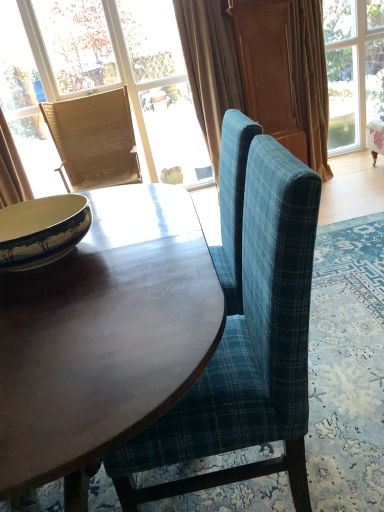
Image resolution: width=384 pixels, height=512 pixels. What do you see at coordinates (94, 140) in the screenshot? I see `woven wicker chair at left, which appears as the 2th chair when viewed from the right` at bounding box center [94, 140].

The width and height of the screenshot is (384, 512). What do you see at coordinates (11, 170) in the screenshot?
I see `beige fabric curtain at left, which appears as the 3th curtain when viewed from the right` at bounding box center [11, 170].

I want to click on silky beige curtain at upper right, positioned as the 1th curtain in right-to-left order, so click(x=309, y=80).

What do you see at coordinates (247, 349) in the screenshot? Image resolution: width=384 pixels, height=512 pixels. I see `blue plaid fabric chair at center, positioned as the first chair in right-to-left order` at bounding box center [247, 349].

The width and height of the screenshot is (384, 512). Describe the element at coordinates (353, 69) in the screenshot. I see `clear glass window at upper right, which ranks as the 1th window in right-to-left order` at that location.

The height and width of the screenshot is (512, 384). What do you see at coordinates (42, 230) in the screenshot?
I see `yellow glazed bowl at left` at bounding box center [42, 230].

Find the location of a particular element. wooden screen door at upper center is located at coordinates (266, 69).

Can you confirm if matte wicker chair at upper left, positioned as the first window in left-to-right order, is bigger than clear glass window at upper right, which ranks as the 1th window in right-to-left order?

Incorrect, matte wicker chair at upper left, positioned as the first window in left-to-right order, is not larger than clear glass window at upper right, which ranks as the 1th window in right-to-left order.

Considering the relative positions of matte wicker chair at upper left, arranged as the 2th window when viewed from the right, and clear glass window at upper right, which is the second window in left-to-right order, in the image provided, is matte wicker chair at upper left, arranged as the 2th window when viewed from the right, in front of clear glass window at upper right, which is the second window in left-to-right order,?

Yes, matte wicker chair at upper left, arranged as the 2th window when viewed from the right, is in front of clear glass window at upper right, which is the second window in left-to-right order.

Does matte wicker chair at upper left, arranged as the 2th window when viewed from the right, have a greater height compared to clear glass window at upper right, which ranks as the 1th window in right-to-left order?

Indeed, matte wicker chair at upper left, arranged as the 2th window when viewed from the right, has a greater height compared to clear glass window at upper right, which ranks as the 1th window in right-to-left order.

Is matte wicker chair at upper left, arranged as the 2th window when viewed from the right, not inside clear glass window at upper right, which is the second window in left-to-right order?

matte wicker chair at upper left, arranged as the 2th window when viewed from the right, is positioned outside clear glass window at upper right, which is the second window in left-to-right order.

Is matte dark wood desk at center further to the viewer compared to beige fabric curtain at left, which appears as the 3th curtain when viewed from the right?

No.

Are matte dark wood desk at center and beige fabric curtain at left, which appears as the 3th curtain when viewed from the right, far apart?

That's right, there is a large distance between matte dark wood desk at center and beige fabric curtain at left, which appears as the 3th curtain when viewed from the right.

Which is in front, point (28, 317) or point (19, 161)?

Point (28, 317)

Which is more to the left, matte dark wood desk at center or beige fabric curtain at left, which is the first curtain from left to right?

From the viewer's perspective, beige fabric curtain at left, which is the first curtain from left to right, appears more on the left side.

Does silky beige curtain at upper right, positioned as the 1th curtain in right-to-left order, have a larger size compared to yellow glazed bowl at left?

Yes, silky beige curtain at upper right, positioned as the 1th curtain in right-to-left order, is bigger than yellow glazed bowl at left.

Does silky beige curtain at upper right, positioned as the 1th curtain in right-to-left order, have a greater width compared to yellow glazed bowl at left?

Yes, silky beige curtain at upper right, positioned as the 1th curtain in right-to-left order, is wider than yellow glazed bowl at left.

From a real-world perspective, relative to yellow glazed bowl at left, is silky beige curtain at upper right, arranged as the 3th curtain when viewed from the left, vertically above or below?

From a real-world perspective, silky beige curtain at upper right, arranged as the 3th curtain when viewed from the left, is physically below yellow glazed bowl at left.

Is the surface of silky beige curtain at upper right, arranged as the 3th curtain when viewed from the left, in direct contact with yellow glazed bowl at left?

No, silky beige curtain at upper right, arranged as the 3th curtain when viewed from the left, is not with yellow glazed bowl at left.

From a real-world perspective, is yellow glazed bowl at left under beige fabric curtain at left, which is the first curtain from left to right?

No, from a real-world perspective, yellow glazed bowl at left is not below beige fabric curtain at left, which is the first curtain from left to right.

How distant is yellow glazed bowl at left from beige fabric curtain at left, which is the first curtain from left to right?

yellow glazed bowl at left is 2.04 meters from beige fabric curtain at left, which is the first curtain from left to right.

Is yellow glazed bowl at left next to beige fabric curtain at left, which appears as the 3th curtain when viewed from the right, and touching it?

No, yellow glazed bowl at left is not in contact with beige fabric curtain at left, which appears as the 3th curtain when viewed from the right.

Is yellow glazed bowl at left situated inside matte dark wood desk at center or outside?

yellow glazed bowl at left exists outside the volume of matte dark wood desk at center.

Can you confirm if yellow glazed bowl at left is taller than matte dark wood desk at center?

Incorrect, the height of yellow glazed bowl at left is not larger of that of matte dark wood desk at center.

Is yellow glazed bowl at left turned away from matte dark wood desk at center?

No, matte dark wood desk at center is not at the back of yellow glazed bowl at left.

Is wooden screen door at upper center facing towards matte dark wood desk at center?

No, wooden screen door at upper center is not facing towards matte dark wood desk at center.

Considering the relative sizes of wooden screen door at upper center and matte dark wood desk at center in the image provided, is wooden screen door at upper center thinner than matte dark wood desk at center?

Correct, the width of wooden screen door at upper center is less than that of matte dark wood desk at center.

Are wooden screen door at upper center and matte dark wood desk at center located far from each other?

Yes.

Can we say wooden screen door at upper center lies outside matte dark wood desk at center?

That's correct, wooden screen door at upper center is outside of matte dark wood desk at center.

What's the angular difference between yellow glazed bowl at left and matte wicker chair at upper left, arranged as the 2th window when viewed from the right,'s facing directions?

The angle between the facing direction of yellow glazed bowl at left and the facing direction of matte wicker chair at upper left, arranged as the 2th window when viewed from the right, is 84.4 degrees.

Where is `bowl on the right of the matte wicker chair at upper left, positioned as the first window in left-to-right order`? The image size is (384, 512). bowl on the right of the matte wicker chair at upper left, positioned as the first window in left-to-right order is located at coordinates (42, 230).

How far apart are yellow glazed bowl at left and matte wicker chair at upper left, positioned as the first window in left-to-right order?

A distance of 2.50 meters exists between yellow glazed bowl at left and matte wicker chair at upper left, positioned as the first window in left-to-right order.

Is yellow glazed bowl at left facing towards matte wicker chair at upper left, arranged as the 2th window when viewed from the right?

No, yellow glazed bowl at left is not aimed at matte wicker chair at upper left, arranged as the 2th window when viewed from the right.

This screenshot has height=512, width=384. What are the coordinates of `window below the clear glass window at upper right, which ranks as the 1th window in right-to-left order (from the image's perspective)` in the screenshot? It's located at (105, 72).

Locate an element on the screen. The width and height of the screenshot is (384, 512). desk located in front of the beige fabric curtain at left, which is the first curtain from left to right is located at coordinates (104, 337).

When comparing their distances from beige velvet curtain at upper center, which is the 2th curtain in right-to-left order, does matte wicker chair at upper left, arranged as the 2th window when viewed from the right, or blue plaid fabric chair at center, placed as the second chair when sorted from back to front, seem further?

Based on the image, blue plaid fabric chair at center, placed as the second chair when sorted from back to front, appears to be further to beige velvet curtain at upper center, which is the 2th curtain in right-to-left order.

From the image, which object appears to be farther from blue plaid fabric chair at center, the 2th chair when ordered from left to right, matte wicker chair at upper left, positioned as the first window in left-to-right order, or woven wicker chair at left, the first chair positioned from the left?

Among the two, matte wicker chair at upper left, positioned as the first window in left-to-right order, is located further to blue plaid fabric chair at center, the 2th chair when ordered from left to right.

Estimate the real-world distances between objects in this image. Which object is further from yellow glazed bowl at left, woven wicker chair at left, which is the first chair in back-to-front order, or matte dark wood desk at center?

Based on the image, woven wicker chair at left, which is the first chair in back-to-front order, appears to be further to yellow glazed bowl at left.

In the scene shown: When comparing their distances from matte dark wood desk at center, does matte wicker chair at upper left, positioned as the first window in left-to-right order, or beige fabric curtain at left, which is the first curtain from left to right, seem closer?

Based on the image, beige fabric curtain at left, which is the first curtain from left to right, appears to be nearer to matte dark wood desk at center.

From the image, which object appears to be nearer to beige velvet curtain at upper center, the second curtain from the left, clear glass window at upper right, which is the second window in left-to-right order, or matte dark wood desk at center?

The object closer to beige velvet curtain at upper center, the second curtain from the left, is clear glass window at upper right, which is the second window in left-to-right order.

Based on their spatial positions, is silky beige curtain at upper right, arranged as the 3th curtain when viewed from the left, or woven wicker chair at left, which appears as the 1th chair when viewed from the top, further from wooden screen door at upper center?

woven wicker chair at left, which appears as the 1th chair when viewed from the top.

When comparing their distances from blue plaid fabric chair at center, which is the second chair from top to bottom, does woven wicker chair at left, the first chair positioned from the left, or matte wicker chair at upper left, arranged as the 2th window when viewed from the right, seem further?

The object further to blue plaid fabric chair at center, which is the second chair from top to bottom, is matte wicker chair at upper left, arranged as the 2th window when viewed from the right.

Based on their spatial positions, is clear glass window at upper right, which ranks as the 1th window in right-to-left order, or matte wicker chair at upper left, positioned as the first window in left-to-right order, closer to yellow glazed bowl at left?

matte wicker chair at upper left, positioned as the first window in left-to-right order, lies closer to yellow glazed bowl at left than the other object.

Find the location of a particular element. Image resolution: width=384 pixels, height=512 pixels. chair between matte dark wood desk at center and woven wicker chair at left, positioned as the 2th chair in bottom-to-top order, in the front-back direction is located at coordinates (247, 349).

Locate an element on the screen. chair positioned between blue plaid fabric chair at center, placed as the second chair when sorted from back to front, and silky beige curtain at upper right, positioned as the 1th curtain in right-to-left order, from near to far is located at coordinates (94, 140).

Find the location of a particular element. screen door located between yellow glazed bowl at left and matte wicker chair at upper left, positioned as the first window in left-to-right order, in the depth direction is located at coordinates (266, 69).

The height and width of the screenshot is (512, 384). In order to click on bowl positioned between matte dark wood desk at center and clear glass window at upper right, which is the second window in left-to-right order, from near to far in this screenshot , I will do `click(42, 230)`.